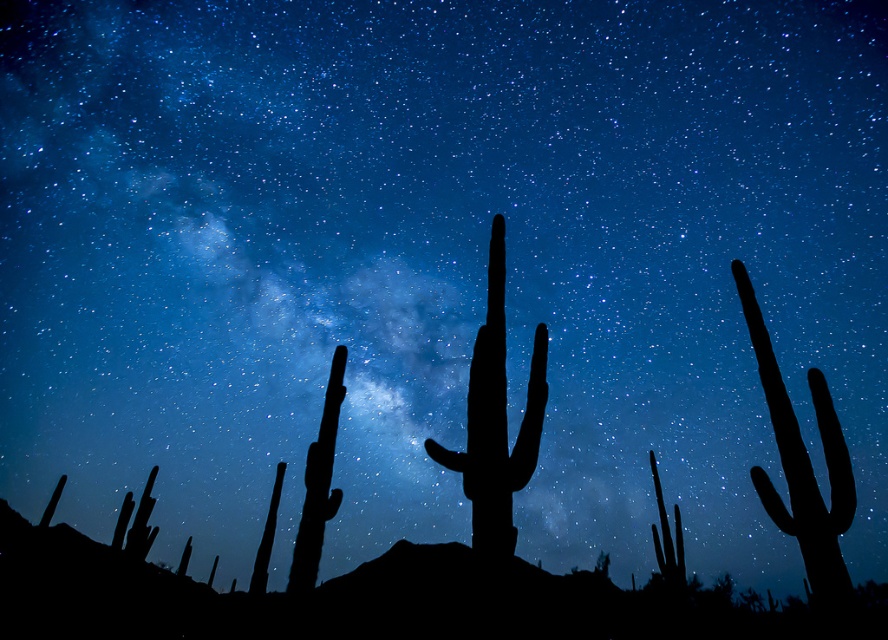
Looking at this image, you are an astronomer observing the night sky and notice two cacti in the foreground. Which one is smaller in size between the black matte cactus at center and the silhouette cactus at right?

The black matte cactus at center has a smaller size compared to the silhouette cactus at right, so the black matte cactus at center is smaller.

You are an astronomer setting up a telescope in the desert. You have two cacti nearby for reference. The black matte cactus at center and the silhouette cactus at right. Which cactus is wider? Please answer based on their widths.

The silhouette cactus at right is wider than the black matte cactus at center.

You are an astronomer observing the night sky and notice two cacti in the foreground. Which cactus, the black matte cactus at center or the silhouette cactus at right, is taller?

The silhouette cactus at right is taller than the black matte cactus at center.